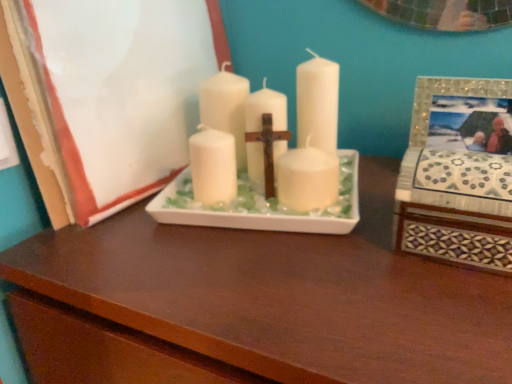
Question: Does matte white picture frame at center, placed as the second picture frame when sorted from right to left, appear on the right side of white matte candle at center?

Choices:
 (A) yes
 (B) no

Answer: (B)

Question: Considering the relative sizes of matte white picture frame at center, the 1th picture frame in the left-to-right sequence, and white matte candle at center in the image provided, is matte white picture frame at center, the 1th picture frame in the left-to-right sequence, wider than white matte candle at center?

Choices:
 (A) yes
 (B) no

Answer: (B)

Question: Can you confirm if matte white picture frame at center, placed as the second picture frame when sorted from right to left, is taller than white matte candle at center?

Choices:
 (A) yes
 (B) no

Answer: (A)

Question: From the image's perspective, is matte white picture frame at center, placed as the second picture frame when sorted from right to left, on top of white matte candle at center?

Choices:
 (A) yes
 (B) no

Answer: (A)

Question: Considering the relative sizes of matte white picture frame at center, the 1th picture frame in the left-to-right sequence, and white matte candle at center in the image provided, is matte white picture frame at center, the 1th picture frame in the left-to-right sequence, smaller than white matte candle at center?

Choices:
 (A) yes
 (B) no

Answer: (B)

Question: Considering the positions of mosaic tile picture frame at right, placed as the first picture frame when sorted from right to left, and white matte candle at center in the image, is mosaic tile picture frame at right, placed as the first picture frame when sorted from right to left, taller or shorter than white matte candle at center?

Choices:
 (A) tall
 (B) short

Answer: (B)

Question: Is mosaic tile picture frame at right, which is the second picture frame from left to right, situated inside white matte candle at center or outside?

Choices:
 (A) outside
 (B) inside

Answer: (A)

Question: Looking at the image, does mosaic tile picture frame at right, placed as the first picture frame when sorted from right to left, seem bigger or smaller compared to white matte candle at center?

Choices:
 (A) small
 (B) big

Answer: (A)

Question: Is mosaic tile picture frame at right, which is the second picture frame from left to right, wider or thinner than white matte candle at center?

Choices:
 (A) thin
 (B) wide

Answer: (A)

Question: Considering the positions of point (116, 127) and point (288, 382), is point (116, 127) closer or farther from the camera than point (288, 382)?

Choices:
 (A) farther
 (B) closer

Answer: (A)

Question: From a real-world perspective, is matte white picture frame at center, placed as the second picture frame when sorted from right to left, physically located above or below matte white tray at center?

Choices:
 (A) above
 (B) below

Answer: (A)

Question: Is matte white picture frame at center, placed as the second picture frame when sorted from right to left, bigger or smaller than matte white tray at center?

Choices:
 (A) big
 (B) small

Answer: (B)

Question: Relative to matte white tray at center, is matte white picture frame at center, placed as the second picture frame when sorted from right to left, in front or behind?

Choices:
 (A) front
 (B) behind

Answer: (B)

Question: From a real-world perspective, is mosaic tile picture frame at right, which is the second picture frame from left to right, above or below matte white tray at center?

Choices:
 (A) above
 (B) below

Answer: (A)

Question: Relative to matte white tray at center, is mosaic tile picture frame at right, placed as the first picture frame when sorted from right to left, in front or behind?

Choices:
 (A) behind
 (B) front

Answer: (A)